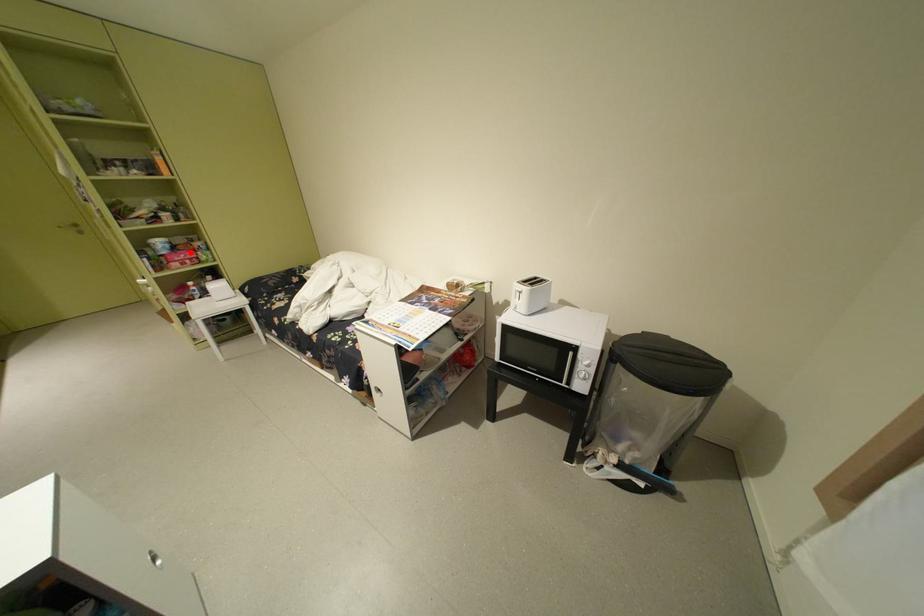
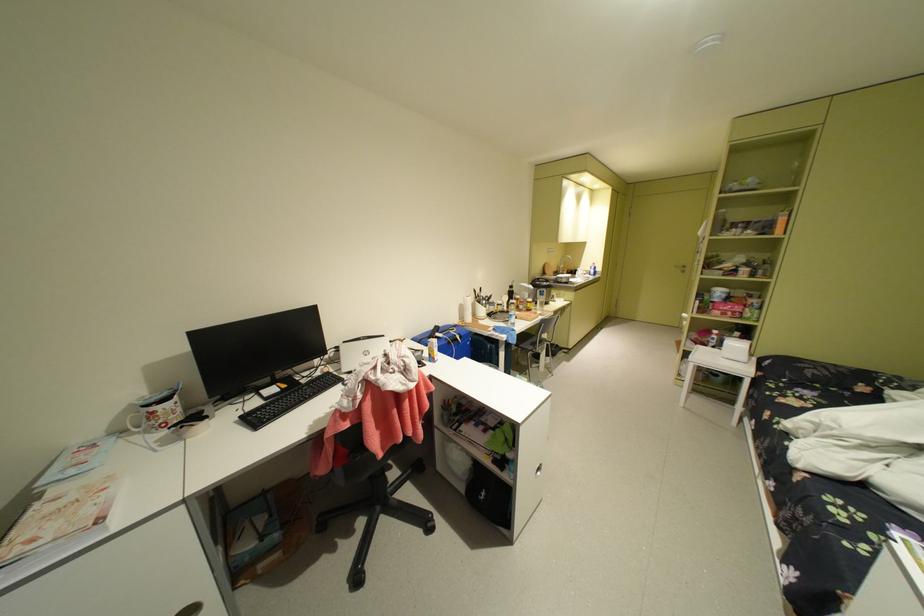
In the second image, find the point that corresponds to the highlighted location in the first image.

(740, 304)